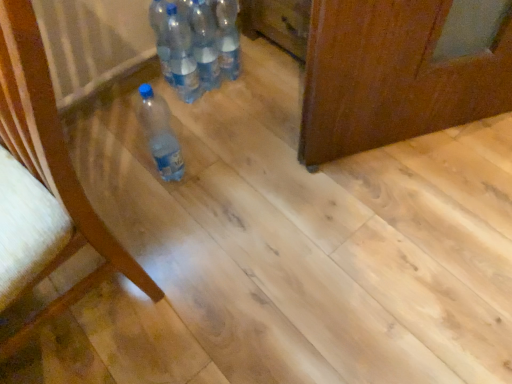
Identify the location of vacant space behind matte wood chair at left. The width and height of the screenshot is (512, 384). (140, 176).